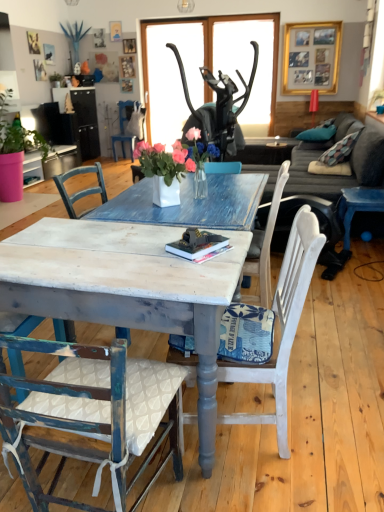
Question: In terms of height, does teal fabric pillow at upper right look taller or shorter compared to gray fabric couch at center?

Choices:
 (A) short
 (B) tall

Answer: (A)

Question: From a real-world perspective, is teal fabric pillow at upper right above or below gray fabric couch at center?

Choices:
 (A) above
 (B) below

Answer: (A)

Question: Considering the real-world distances, which object is closest to the gray fabric couch at center?

Choices:
 (A) distressed white chair at lower left, positioned as the 2th chair in left-to-right order
 (B) white fabric chair at center, marked as the 2th chair in a top-to-bottom arrangement
 (C) teal fabric pillow at upper right
 (D) distressed wood table at center
 (E) gold metallic picture frame at upper center

Answer: (C)

Question: Estimate the real-world distances between objects in this image. Which object is closer to the white fabric chair at center, positioned as the 3th chair in back-to-front order?

Choices:
 (A) white fabric chair at upper center, the 4th chair in the bottom-to-top sequence
 (B) white ceramic vase at center
 (C) distressed white chair at lower left, positioned as the 2th chair in left-to-right order
 (D) teal fabric pillow at upper right
 (E) gold metallic picture frame at upper center

Answer: (C)